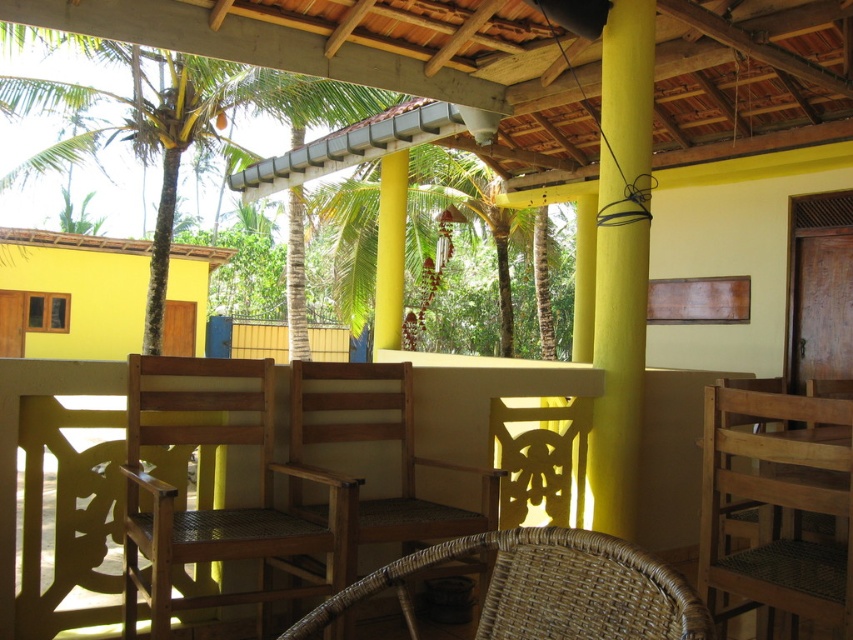
In the scene shown: Is natural wood chairs at center closer to the viewer compared to wooden chair at right?

No, natural wood chairs at center is behind wooden chair at right.

Does point (686, 442) come in front of point (727, 440)?

No.

Between point (374, 560) and point (844, 445), which one is positioned in front?

Point (844, 445)

Where is `natural wood chairs at center`? This screenshot has width=853, height=640. natural wood chairs at center is located at coordinates click(479, 396).

Is point (268, 420) positioned behind point (605, 284)?

No, (268, 420) is in front of (605, 284).

Between wooden chair at center and yellow matte/wooden pillar at center-right, which one is positioned lower?

Positioned lower is wooden chair at center.

The image size is (853, 640). In order to click on wooden chair at center in this screenshot , I will do `click(222, 508)`.

Does wooden chair at center have a greater width compared to woven wicker chair at center?

Indeed, wooden chair at center has a greater width compared to woven wicker chair at center.

Locate an element on the screen. wooden chair at center is located at coordinates (222, 508).

The height and width of the screenshot is (640, 853). I want to click on wooden chair at center, so click(222, 508).